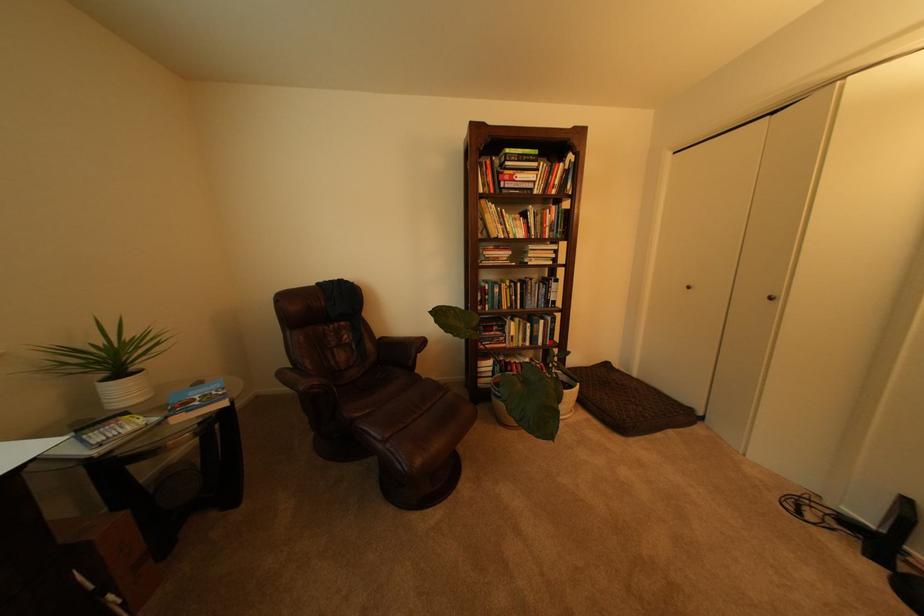
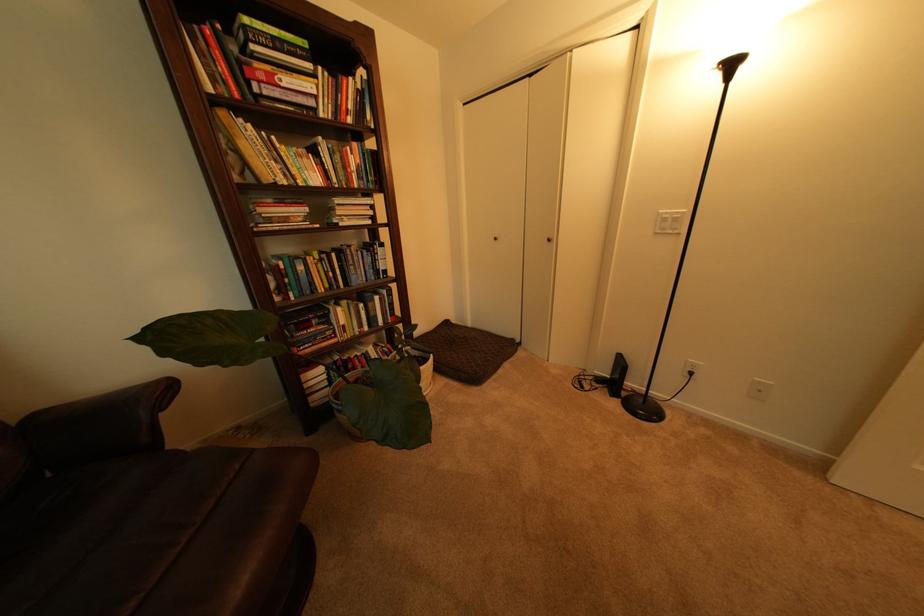
Question: The camera is either moving clockwise (left) or counter-clockwise (right) around the object. The first image is from the beginning of the video and the second image is from the end. Is the camera moving left or right when shooting the video?

Choices:
 (A) Left
 (B) Right

Answer: (A)